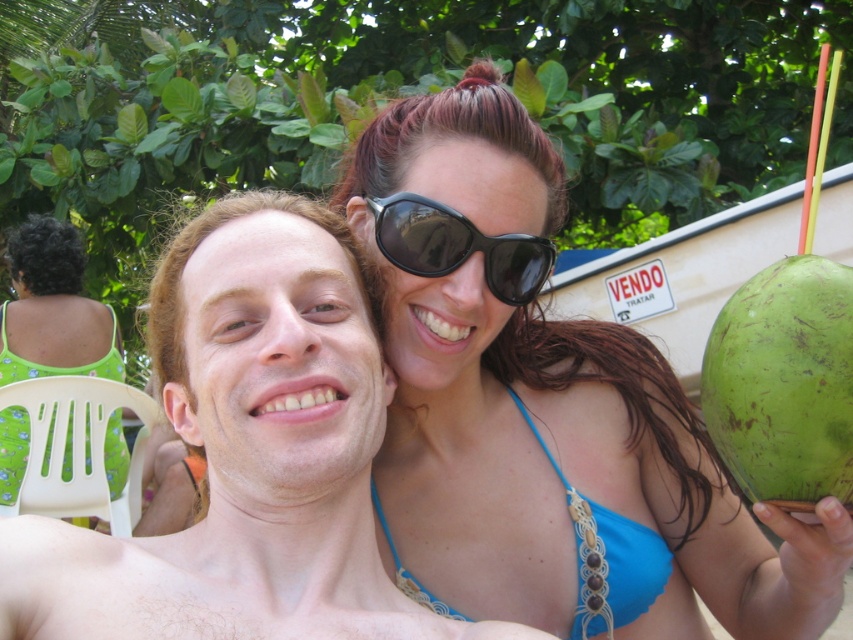
Question: Is blue macrame bikini top at upper right bigger than black plastic sunglasses at upper center?

Choices:
 (A) yes
 (B) no

Answer: (A)

Question: Is blue bikini top at center positioned before blue macrame bikini top at upper right?

Choices:
 (A) no
 (B) yes

Answer: (B)

Question: Which of the following is the farthest from the observer?

Choices:
 (A) (379, 244)
 (B) (708, 333)

Answer: (B)

Question: Does blue bikini top at center appear under green floral dress at upper left?

Choices:
 (A) yes
 (B) no

Answer: (A)

Question: Which object is closer to the camera taking this photo?

Choices:
 (A) green floral dress at upper left
 (B) blue bikini top at center
 (C) black plastic sunglasses at upper center

Answer: (B)

Question: Which object is closer to the camera taking this photo?

Choices:
 (A) green rough coconut at right
 (B) green floral dress at upper left
 (C) matte skin at center
 (D) blue macrame bikini top at upper right

Answer: (A)